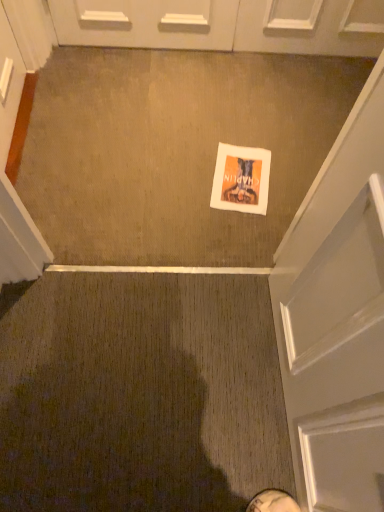
Measure the distance between white glossy door at upper center and camera.

1.71 meters.

Measure the distance between point (174, 10) and camera.

A distance of 1.74 meters exists between point (174, 10) and camera.

What do you see at coordinates (272, 502) in the screenshot? I see `white leather shoe at lower center` at bounding box center [272, 502].

What do you see at coordinates (241, 179) in the screenshot? The height and width of the screenshot is (512, 384). I see `white paper flyer at center` at bounding box center [241, 179].

Where is `white glossy door at upper center`? white glossy door at upper center is located at coordinates (225, 25).

From a real-world perspective, is white paper flyer at center under white glossy door at upper center?

Yes, from a real-world perspective, white paper flyer at center is beneath white glossy door at upper center.

Visually, is white paper flyer at center positioned to the left or to the right of white glossy door at upper center?

white paper flyer at center is positioned on white glossy door at upper center's right side.

Does white paper flyer at center have a larger size compared to white glossy door at upper center?

Incorrect, white paper flyer at center is not larger than white glossy door at upper center.

Is white paper flyer at center positioned with its back to white glossy door at upper center?

Yes, white glossy door at upper center is at the back of white paper flyer at center.

Looking at this image, is white glossy door at upper center to the right of white paper flyer at center from the viewer's perspective?

No, white glossy door at upper center is not to the right of white paper flyer at center.

Who is bigger, white glossy door at upper center or white paper flyer at center?

white glossy door at upper center.

Considering the positions of points (92, 21) and (232, 163), is point (92, 21) farther from camera compared to point (232, 163)?

Yes, it is behind point (232, 163).

From a real-world perspective, is white glossy door at upper center positioned over white paper flyer at center based on gravity?

Correct, in the physical world, white glossy door at upper center is higher than white paper flyer at center.

From a real-world perspective, does white leather shoe at lower center sit lower than white glossy door at upper center?

Yes, from a real-world perspective, white leather shoe at lower center is below white glossy door at upper center.

Is the surface of white leather shoe at lower center in direct contact with white glossy door at upper center?

No, white leather shoe at lower center is not beside white glossy door at upper center.

How different are the orientations of white leather shoe at lower center and white glossy door at upper center in degrees?

There is a 86.2-degree angle between the facing directions of white leather shoe at lower center and white glossy door at upper center.

Between white leather shoe at lower center and white glossy door at upper center, which one has larger width?

With larger width is white leather shoe at lower center.

Locate an element on the screen. The width and height of the screenshot is (384, 512). footwear below the white glossy door at upper center (from a real-world perspective) is located at coordinates (272, 502).

From the image's perspective, is white glossy door at upper center located beneath white leather shoe at lower center?

No, from the image's perspective, white glossy door at upper center is not beneath white leather shoe at lower center.

From a real-world perspective, between white glossy door at upper center and white leather shoe at lower center, who is vertically lower?

From a 3D spatial view, white leather shoe at lower center is below.

Is white glossy door at upper center positioned beyond the bounds of white leather shoe at lower center?

Yes.

Considering the sizes of white leather shoe at lower center and white paper flyer at center in the image, is white leather shoe at lower center bigger or smaller than white paper flyer at center?

Clearly, white leather shoe at lower center is larger in size than white paper flyer at center.

Considering the relative sizes of white leather shoe at lower center and white paper flyer at center in the image provided, is white leather shoe at lower center thinner than white paper flyer at center?

Yes.

Consider the image. Can you confirm if white leather shoe at lower center is taller than white paper flyer at center?

Yes, white leather shoe at lower center is taller than white paper flyer at center.

How many degrees apart are the facing directions of white leather shoe at lower center and white paper flyer at center?

white leather shoe at lower center and white paper flyer at center are facing 79.6 degrees away from each other.

Find the location of `footwear above the white paper flyer at center (from a real-world perspective)`. footwear above the white paper flyer at center (from a real-world perspective) is located at coordinates (272, 502).

From the image's perspective, is white paper flyer at center located above white leather shoe at lower center?

Yes, from the image's perspective, white paper flyer at center is above white leather shoe at lower center.

Would you consider white paper flyer at center to be distant from white leather shoe at lower center?

That's right, there is a large distance between white paper flyer at center and white leather shoe at lower center.

Is white paper flyer at center aimed at white leather shoe at lower center?

No.

In the image, there is a white glossy door at upper center. At what (x,y) coordinates should I click in order to perform the action: click on flyer below it (from the image's perspective). Please return your answer as a coordinate pair (x, y). Image resolution: width=384 pixels, height=512 pixels. Looking at the image, I should click on (241, 179).

The image size is (384, 512). I want to click on flyer on the right of white glossy door at upper center, so click(241, 179).

When comparing their distances from white glossy door at upper center, does white leather shoe at lower center or white paper flyer at center seem closer?

white paper flyer at center is closer to white glossy door at upper center.

Considering their positions, is white glossy door at upper center positioned closer to white leather shoe at lower center than white paper flyer at center?

white paper flyer at center is positioned closer to the anchor white leather shoe at lower center.

Estimate the real-world distances between objects in this image. Which object is further from white leather shoe at lower center, white paper flyer at center or white glossy door at upper center?

white glossy door at upper center.

Based on their spatial positions, is white leather shoe at lower center or white glossy door at upper center closer to white paper flyer at center?

white glossy door at upper center is positioned closer to the anchor white paper flyer at center.

Which object lies further to the anchor point white paper flyer at center, white glossy door at upper center or white leather shoe at lower center?

white leather shoe at lower center.

Estimate the real-world distances between objects in this image. Which object is further from white glossy door at upper center, white paper flyer at center or white leather shoe at lower center?

white leather shoe at lower center.

Identify the location of flyer that lies between white glossy door at upper center and white leather shoe at lower center from top to bottom. The width and height of the screenshot is (384, 512). (241, 179).